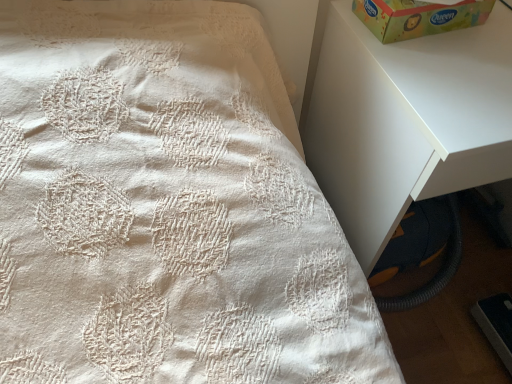
Question: Is white matte nightstand at upper right in front of or behind green paperboard box at upper right in the image?

Choices:
 (A) front
 (B) behind

Answer: (A)

Question: Choose the correct answer: Is white matte nightstand at upper right inside green paperboard box at upper right or outside it?

Choices:
 (A) inside
 (B) outside

Answer: (B)

Question: From the image's perspective, is white matte nightstand at upper right above or below green paperboard box at upper right?

Choices:
 (A) below
 (B) above

Answer: (A)

Question: Is point (449, 16) positioned closer to the camera than point (386, 168)?

Choices:
 (A) closer
 (B) farther

Answer: (B)

Question: Which is correct: green paperboard box at upper right is inside white matte nightstand at upper right, or outside of it?

Choices:
 (A) inside
 (B) outside

Answer: (B)

Question: Considering the positions of green paperboard box at upper right and white matte nightstand at upper right in the image, is green paperboard box at upper right taller or shorter than white matte nightstand at upper right?

Choices:
 (A) short
 (B) tall

Answer: (A)

Question: From the image's perspective, is green paperboard box at upper right above or below white matte nightstand at upper right?

Choices:
 (A) above
 (B) below

Answer: (A)